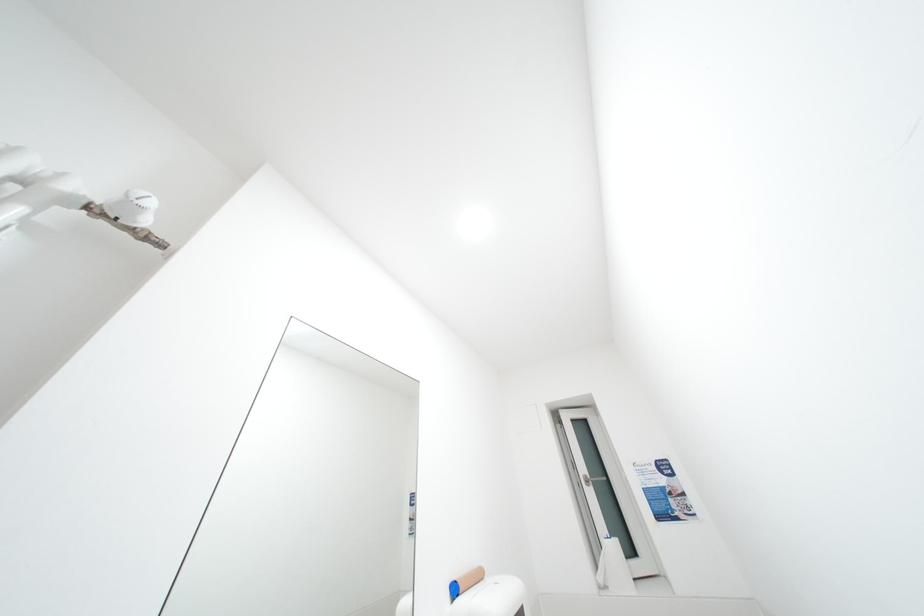
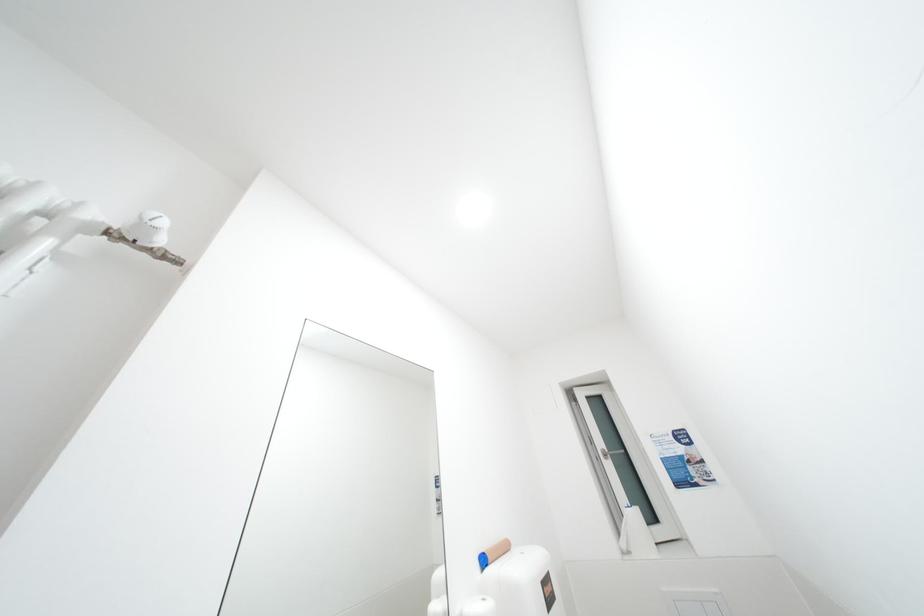
Question: Which direction would the cameraman need to move to produce the second image? Reply with the corresponding letter.

Choices:
 (A) Left
 (B) Right
 (C) Forward
 (D) Backward

Answer: (D)